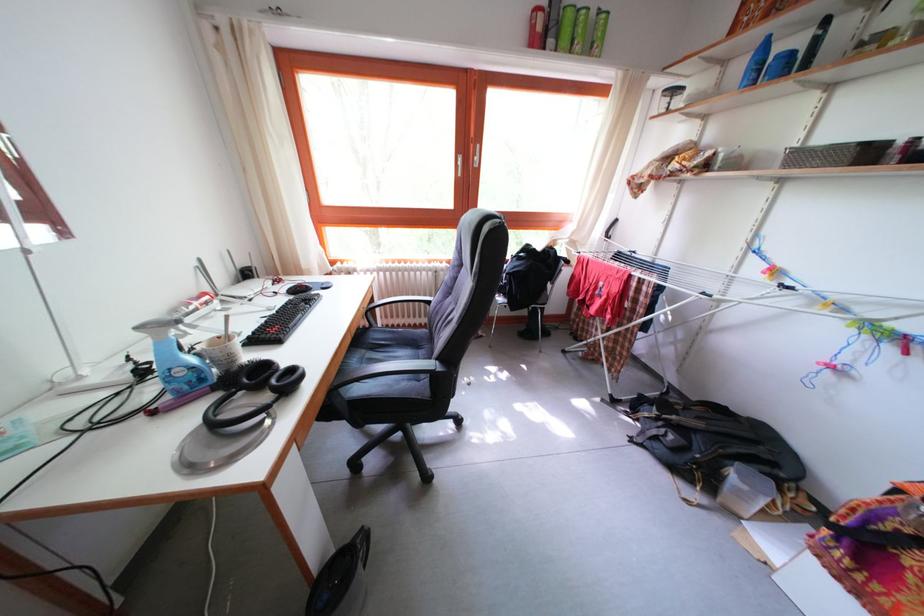
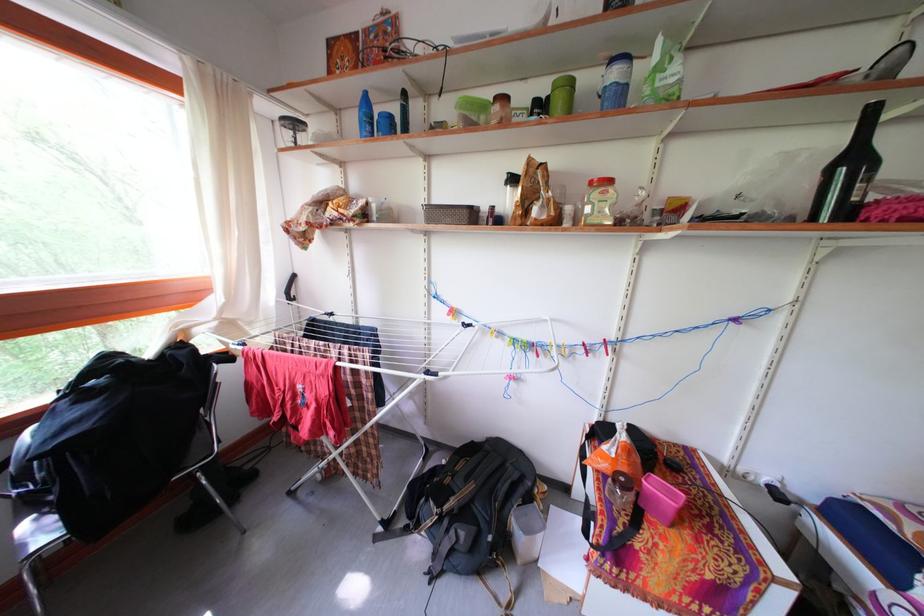
Question: How did the camera likely rotate?

Choices:
 (A) Left
 (B) Right
 (C) Up
 (D) Down

Answer: (B)